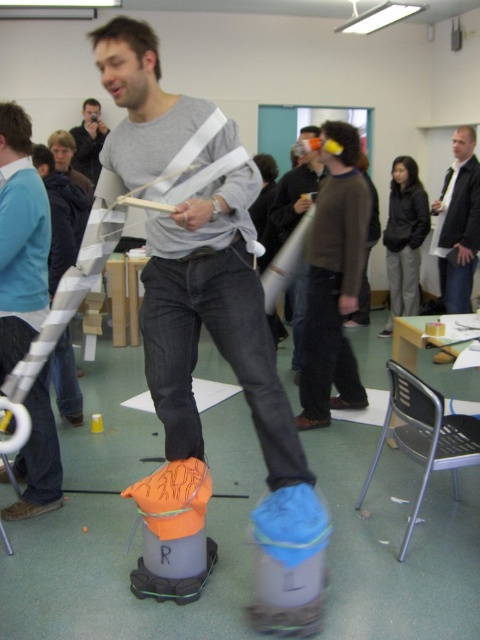
Is orange fabric bag at center behind matte gray sweater at upper center?

That is False.

Between orange fabric bag at center and matte gray sweater at upper center, which one has more height?

orange fabric bag at center

Where is `orange fabric bag at center`? This screenshot has height=640, width=480. orange fabric bag at center is located at coordinates (232, 371).

The image size is (480, 640). In order to click on matte gray sweater at upper center in this screenshot , I will do `click(21, 240)`.

Is matte gray sweater at upper center thinner than dark gray jacket at upper right?

Indeed, matte gray sweater at upper center has a lesser width compared to dark gray jacket at upper right.

Does point (13, 225) come closer to viewer compared to point (451, 241)?

Yes, it is.

Locate an element on the screen. matte gray sweater at upper center is located at coordinates (21, 240).

Which is behind, point (145, 308) or point (283, 188)?

The point (283, 188) is behind.

Which of these two, orange fabric bag at center or matte orange helmet at upper center, stands shorter?

With less height is matte orange helmet at upper center.

Is point (307, 477) positioned in front of point (309, 177)?

Yes, point (307, 477) is in front of point (309, 177).

This screenshot has height=640, width=480. Find the location of `orange fabric bag at center`. orange fabric bag at center is located at coordinates (232, 371).